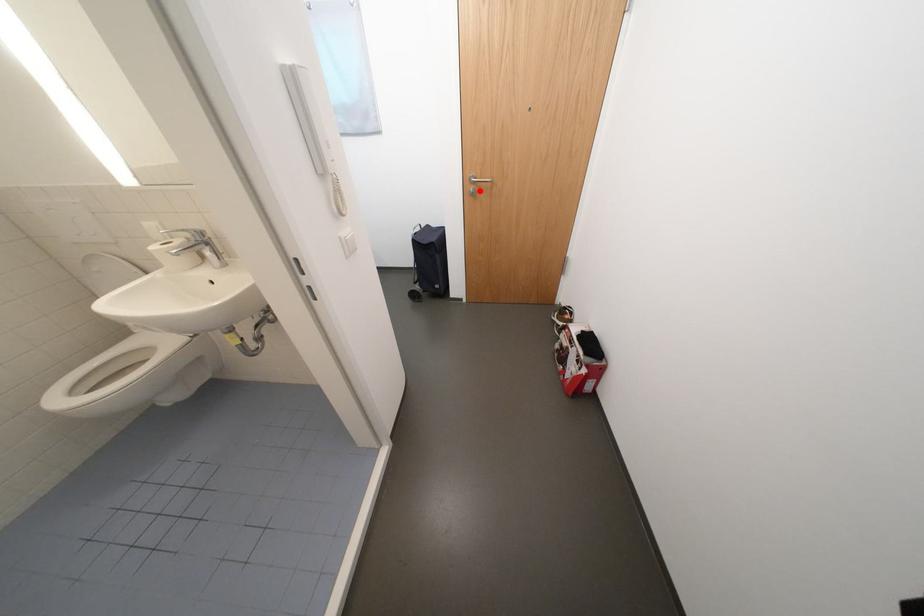
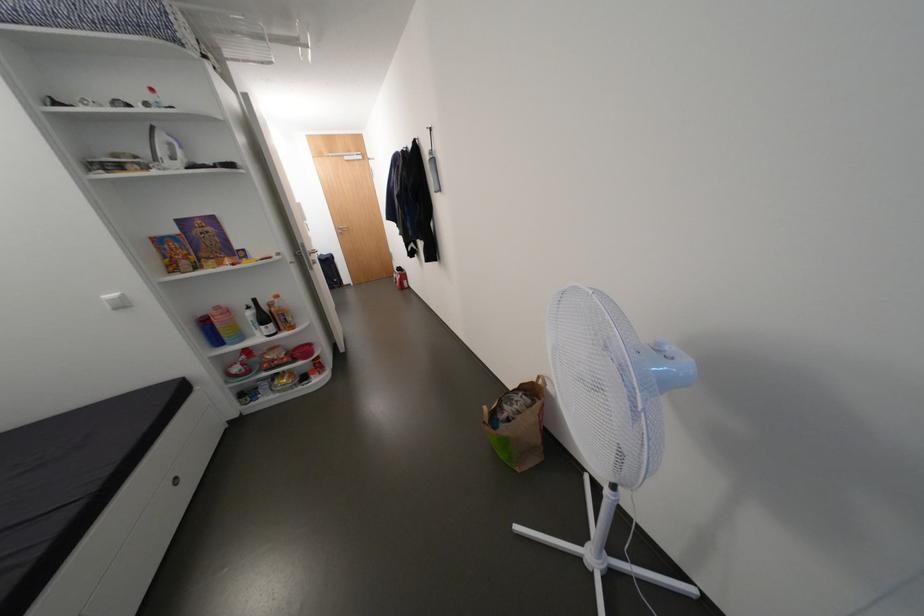
Question: I am providing you with two images of the same scene from different viewpoints. In image1, a red point is highlighted. Considering the same 3D point in image2, which of the following is correct?

Choices:
 (A) It is closer
 (B) It is farther

Answer: (A)